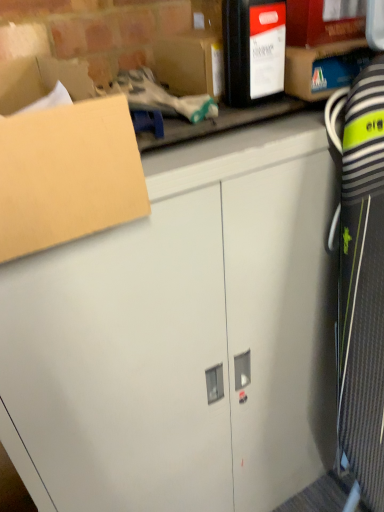
Question: Is matte black box at upper center, which ranks as the 1th storage box in left-to-right order, positioned far away from white matte cabinet at center?

Choices:
 (A) no
 (B) yes

Answer: (A)

Question: Is matte black box at upper center, which ranks as the 1th storage box in left-to-right order, further to the viewer compared to white matte cabinet at center?

Choices:
 (A) yes
 (B) no

Answer: (A)

Question: Is matte black box at upper center, placed as the second storage box when sorted from right to left, aimed at white matte cabinet at center?

Choices:
 (A) yes
 (B) no

Answer: (B)

Question: From the image's perspective, would you say matte black box at upper center, placed as the second storage box when sorted from right to left, is positioned over white matte cabinet at center?

Choices:
 (A) yes
 (B) no

Answer: (A)

Question: From the image's perspective, is matte black box at upper center, placed as the second storage box when sorted from right to left, below white matte cabinet at center?

Choices:
 (A) no
 (B) yes

Answer: (A)

Question: Considering the positions of white matte cabinet at center and brown cardboard box at upper left in the image, is white matte cabinet at center bigger or smaller than brown cardboard box at upper left?

Choices:
 (A) big
 (B) small

Answer: (A)

Question: Is white matte cabinet at center inside the boundaries of brown cardboard box at upper left, or outside?

Choices:
 (A) outside
 (B) inside

Answer: (A)

Question: Is point (86, 437) positioned closer to the camera than point (107, 159)?

Choices:
 (A) closer
 (B) farther

Answer: (B)

Question: Visually, is white matte cabinet at center positioned to the left or to the right of brown cardboard box at upper left?

Choices:
 (A) right
 (B) left

Answer: (A)

Question: Is point (205, 56) closer or farther from the camera than point (223, 173)?

Choices:
 (A) closer
 (B) farther

Answer: (B)

Question: Based on their sizes in the image, would you say matte black box at upper center, which ranks as the 1th storage box in left-to-right order, is bigger or smaller than white matte cabinet at center?

Choices:
 (A) small
 (B) big

Answer: (A)

Question: From the image's perspective, is matte black box at upper center, placed as the second storage box when sorted from right to left, located above or below white matte cabinet at center?

Choices:
 (A) below
 (B) above

Answer: (B)

Question: Would you say matte black box at upper center, placed as the second storage box when sorted from right to left, is inside or outside white matte cabinet at center?

Choices:
 (A) inside
 (B) outside

Answer: (B)

Question: Visually, is matte cardboard box at upper right, the 2th storage box when ordered from left to right, positioned to the left or to the right of brown cardboard box at upper left?

Choices:
 (A) right
 (B) left

Answer: (A)

Question: From the image's perspective, is matte cardboard box at upper right, the 2th storage box when ordered from left to right, located above or below brown cardboard box at upper left?

Choices:
 (A) below
 (B) above

Answer: (B)